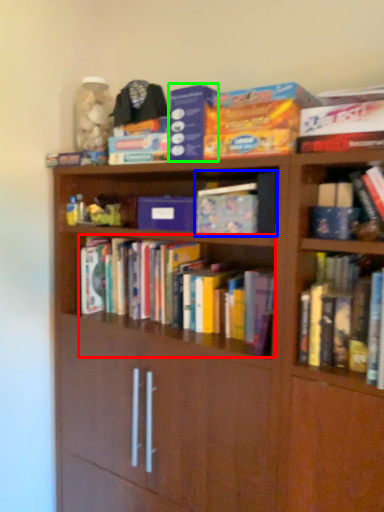
Question: Which object is the farthest from book (highlighted by a red box)? Choose among these: book (highlighted by a blue box) or paperback book (highlighted by a green box).

Choices:
 (A) book
 (B) paperback book

Answer: (B)